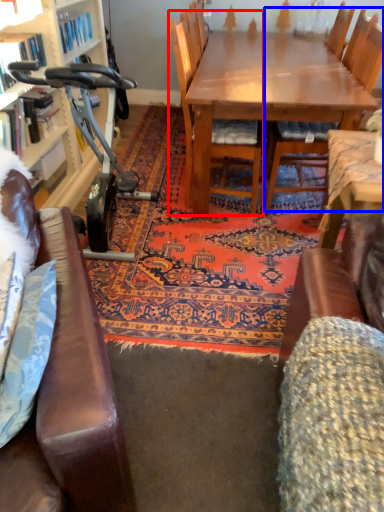
Question: Which object appears farthest to the camera in this image, chair (highlighted by a red box) or chair (highlighted by a blue box)?

Choices:
 (A) chair
 (B) chair

Answer: (B)